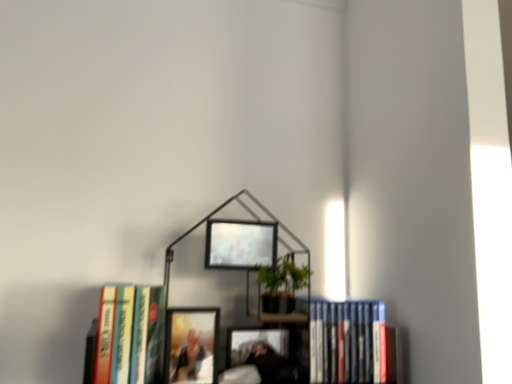
Question: Is metallic silver picture frame at upper center, which is counted as the 1th picture frame, starting from the right, shorter than metallic black bookcase at center?

Choices:
 (A) no
 (B) yes

Answer: (B)

Question: From a real-world perspective, does metallic silver picture frame at upper center, the 2th picture frame when ordered from left to right, stand above metallic black bookcase at center?

Choices:
 (A) yes
 (B) no

Answer: (A)

Question: Is metallic black bookcase at center completely or partially inside metallic silver picture frame at upper center, the 1th picture frame from the top?

Choices:
 (A) yes
 (B) no

Answer: (B)

Question: Does metallic silver picture frame at upper center, which is counted as the 1th picture frame, starting from the right, have a greater height compared to metallic black bookcase at center?

Choices:
 (A) no
 (B) yes

Answer: (A)

Question: Can you confirm if metallic silver picture frame at upper center, the 1th picture frame from the top, is thinner than metallic black bookcase at center?

Choices:
 (A) yes
 (B) no

Answer: (A)

Question: From the image's perspective, is metallic silver picture frame at upper center, the 2th picture frame ordered from the bottom, beneath metallic black bookcase at center?

Choices:
 (A) yes
 (B) no

Answer: (B)

Question: From a real-world perspective, is hardcover book at left, arranged as the 2th book when viewed from the right, beneath metallic silver picture frame at upper center, the 1th picture frame from the top?

Choices:
 (A) no
 (B) yes

Answer: (B)

Question: Does hardcover book at left, the first book in the left-to-right sequence, turn towards metallic silver picture frame at upper center, which is counted as the 1th picture frame, starting from the right?

Choices:
 (A) yes
 (B) no

Answer: (B)

Question: Is hardcover book at left, arranged as the 2th book when viewed from the right, positioned far away from metallic silver picture frame at upper center, the 2th picture frame ordered from the bottom?

Choices:
 (A) yes
 (B) no

Answer: (B)

Question: From the image's perspective, is hardcover book at left, the first book in the left-to-right sequence, below metallic silver picture frame at upper center, which is counted as the 1th picture frame, starting from the right?

Choices:
 (A) yes
 (B) no

Answer: (A)

Question: Is hardcover book at left, the first book in the left-to-right sequence, in contact with metallic silver picture frame at upper center, the 2th picture frame ordered from the bottom?

Choices:
 (A) yes
 (B) no

Answer: (B)

Question: Is hardcover book at left, the first book in the left-to-right sequence, at the right side of metallic silver picture frame at upper center, which is counted as the 1th picture frame, starting from the right?

Choices:
 (A) yes
 (B) no

Answer: (B)

Question: Is hardcover book at left, the first book in the left-to-right sequence, facing towards matte wooden picture frame at center, placed as the first picture frame when sorted from bottom to top?

Choices:
 (A) yes
 (B) no

Answer: (B)